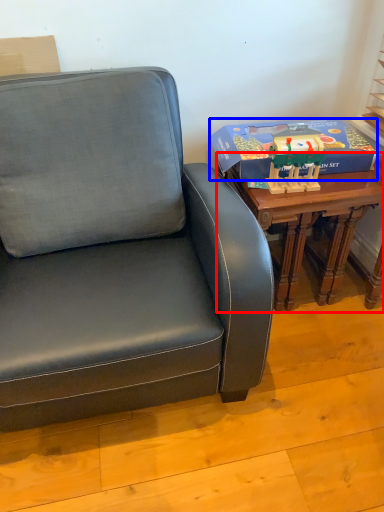
Question: Which point is further to the camera, table (highlighted by a red box) or box (highlighted by a blue box)?

Choices:
 (A) table
 (B) box

Answer: (B)